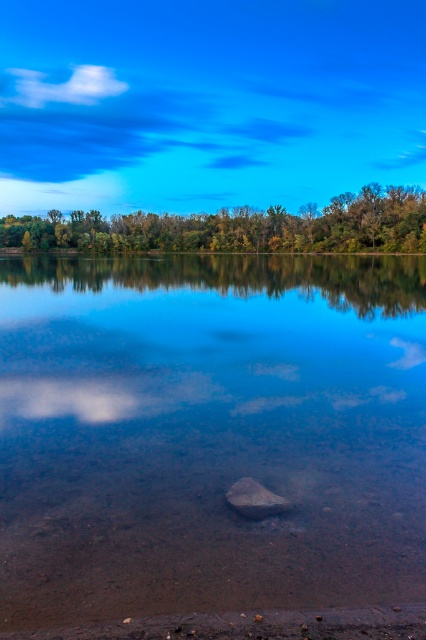
Question: Among these objects, which one is nearest to the camera?

Choices:
 (A) clear glass water at center
 (B) white fluffy cloud at upper left

Answer: (A)

Question: Is white fluffy cloud at upper left above smooth brown rock at center?

Choices:
 (A) yes
 (B) no

Answer: (A)

Question: Does clear glass water at center appear over green leafy trees at upper center?

Choices:
 (A) no
 (B) yes

Answer: (A)

Question: Is green leafy trees at upper center closer to camera compared to smooth brown rock at center?

Choices:
 (A) yes
 (B) no

Answer: (B)

Question: Considering the real-world distances, which object is farthest from the white fluffy cloud at upper left?

Choices:
 (A) smooth brown rock at center
 (B) clear glass water at center
 (C) green leafy trees at upper center

Answer: (A)

Question: Which object is farther from the camera taking this photo?

Choices:
 (A) white fluffy cloud at upper left
 (B) green leafy trees at upper center
 (C) clear glass water at center

Answer: (A)